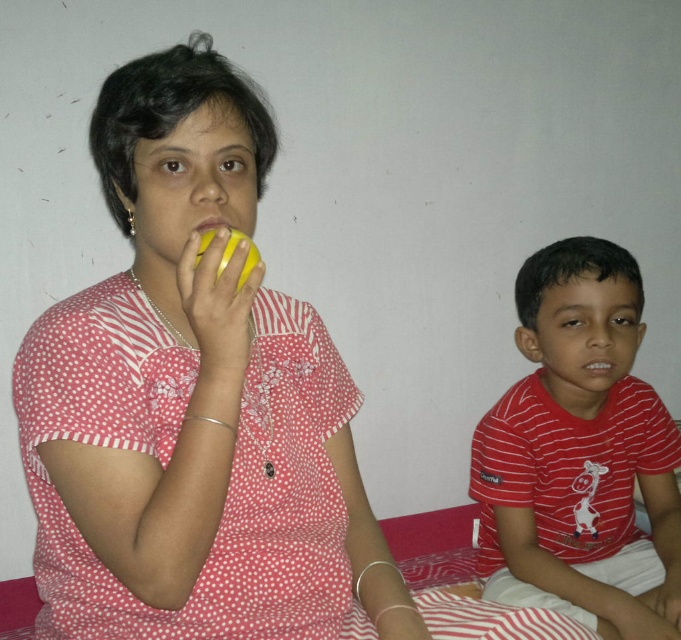
Question: Is matte yellow apple at left below yellow matte apple at upper left?

Choices:
 (A) no
 (B) yes

Answer: (B)

Question: From the image, what is the correct spatial relationship of red striped shirt at right in relation to yellow matte apple at upper left?

Choices:
 (A) below
 (B) above

Answer: (A)

Question: Which point appears closest to the camera in this image?

Choices:
 (A) (669, 570)
 (B) (221, 227)

Answer: (B)

Question: Which of the following is the farthest from the observer?

Choices:
 (A) (548, 417)
 (B) (202, 225)
 (C) (123, 150)

Answer: (A)

Question: Estimate the real-world distances between objects in this image. Which object is farther from the red striped shirt at right?

Choices:
 (A) matte yellow apple at left
 (B) yellow matte apple at upper left

Answer: (B)

Question: Is red striped shirt at right below yellow matte apple at upper left?

Choices:
 (A) yes
 (B) no

Answer: (A)